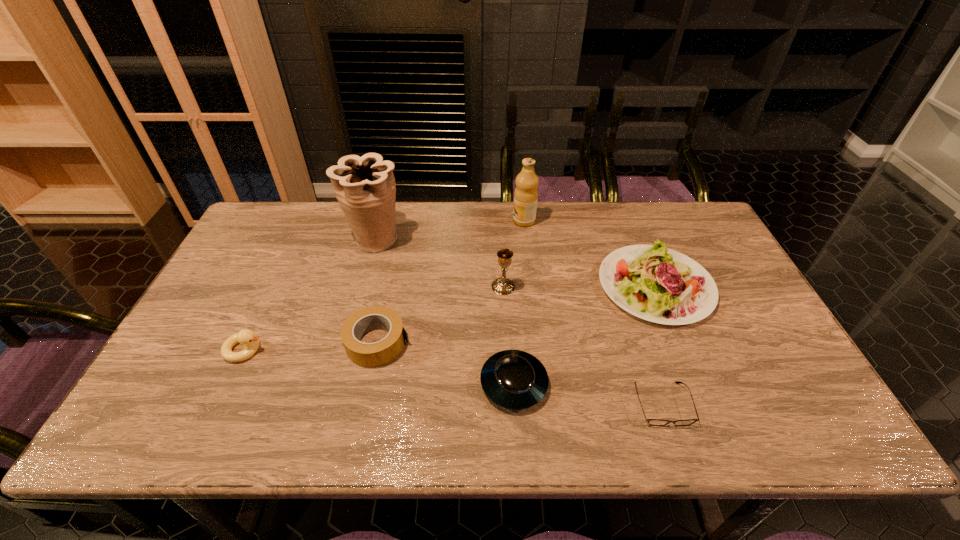
Image resolution: width=960 pixels, height=540 pixels. I want to click on spectacles present at the near edge, so click(654, 422).

I want to click on object located in the left edge section of the desktop, so click(x=251, y=342).

This screenshot has height=540, width=960. Find the location of `object that is positioned at the right edge`. object that is positioned at the right edge is located at coordinates (655, 283).

At what (x,y) coordinates should I click in order to perform the action: click on vacant space at the far edge. Please return your answer as a coordinate pair (x, y). Looking at the image, I should click on coord(481,213).

In the image, there is a desktop. At what (x,y) coordinates should I click in order to perform the action: click on free space at the near edge. Please return your answer as a coordinate pair (x, y). Image resolution: width=960 pixels, height=540 pixels. Looking at the image, I should click on (277, 420).

Where is `blank space at the left edge of the desktop`? The height and width of the screenshot is (540, 960). blank space at the left edge of the desktop is located at coordinates (207, 336).

In the image, there is a desktop. Where is `free space at the right edge`? The image size is (960, 540). free space at the right edge is located at coordinates (795, 397).

Find the location of a particular element. free location at the near left corner is located at coordinates (139, 413).

In the image, there is a desktop. What are the coordinates of `vacant space at the far right corner` in the screenshot? It's located at (654, 212).

This screenshot has width=960, height=540. Find the location of `free area in between the leftmost object and the duct tape`. free area in between the leftmost object and the duct tape is located at coordinates (311, 346).